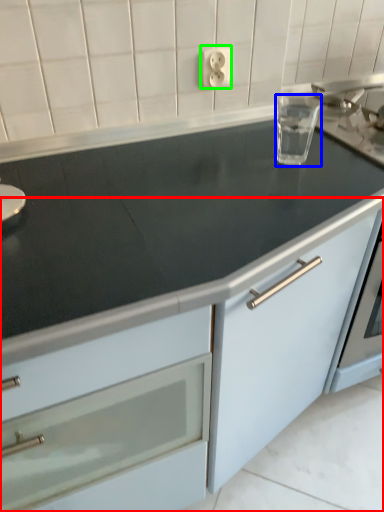
Question: Which object is the farthest from cabinetry (highlighted by a red box)? Choose among these: appliance (highlighted by a blue box) or electric outlet (highlighted by a green box).

Choices:
 (A) appliance
 (B) electric outlet

Answer: (B)